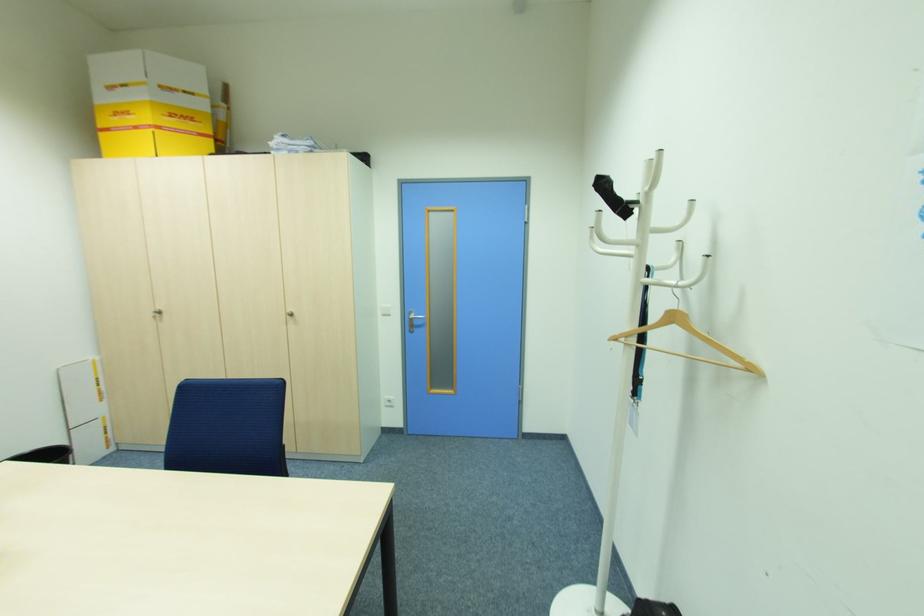
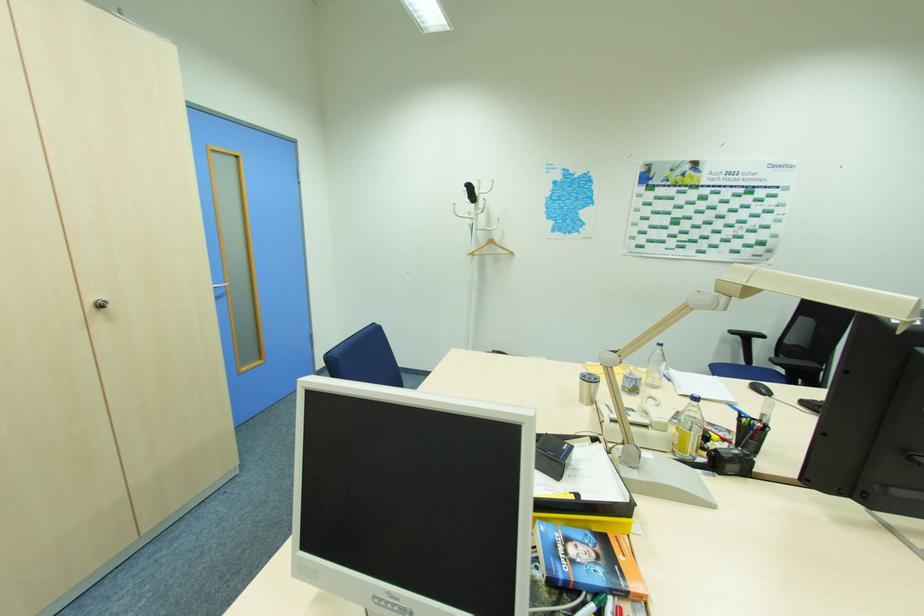
The point at [617,339] is marked in the first image. Where is the corresponding point in the second image?

(472, 254)